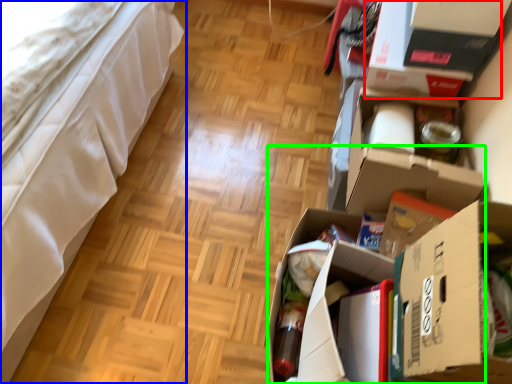
Question: Which object is the farthest from storage box (highlighted by a red box)? Choose among these: furniture (highlighted by a blue box) or cardboard box (highlighted by a green box).

Choices:
 (A) furniture
 (B) cardboard box

Answer: (A)